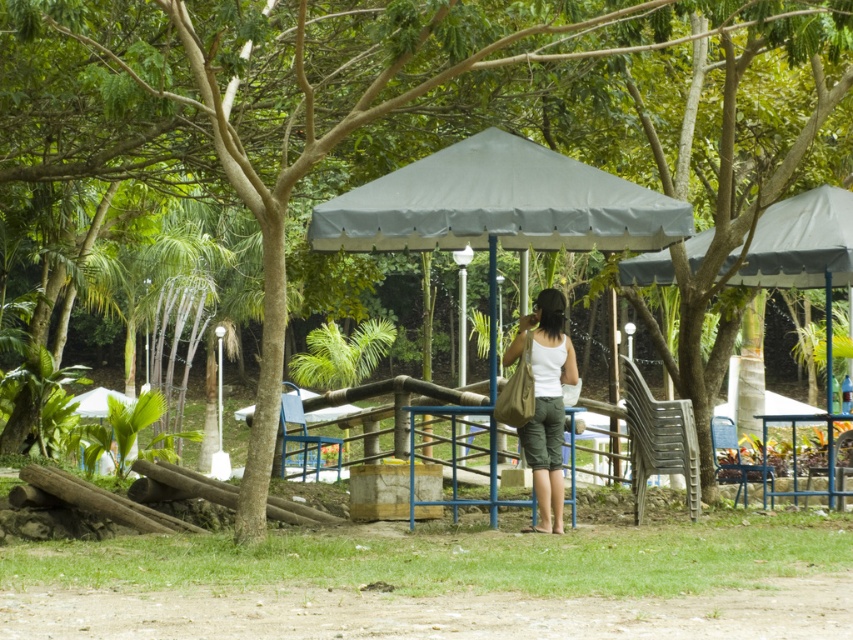
Question: Estimate the real-world distances between objects in this image. Which object is farther from the gray fabric canopy at upper center?

Choices:
 (A) white matte tank top at center
 (B) gray fabric canopy at center

Answer: (A)

Question: Which of the following is the closest to the observer?

Choices:
 (A) (506, 161)
 (B) (798, 282)

Answer: (A)

Question: Does gray fabric canopy at center appear on the left side of white matte tank top at center?

Choices:
 (A) no
 (B) yes

Answer: (B)

Question: Where is gray fabric canopy at upper center located in relation to white matte tank top at center in the image?

Choices:
 (A) right
 (B) left

Answer: (A)

Question: Which object is positioned closest to the white matte tank top at center?

Choices:
 (A) gray fabric canopy at upper center
 (B) gray fabric canopy at center

Answer: (B)

Question: Can you confirm if gray fabric canopy at upper center is positioned to the left of white matte tank top at center?

Choices:
 (A) yes
 (B) no

Answer: (B)